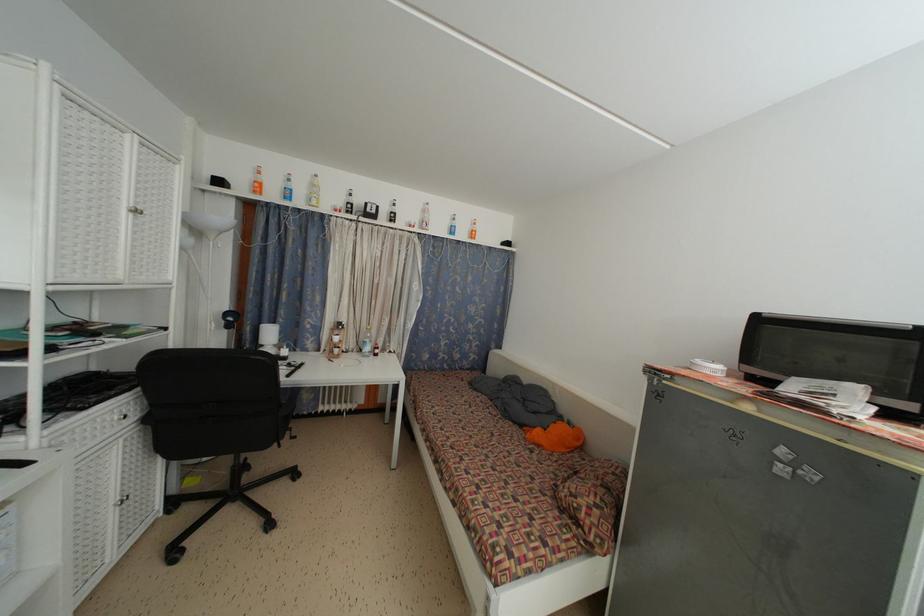
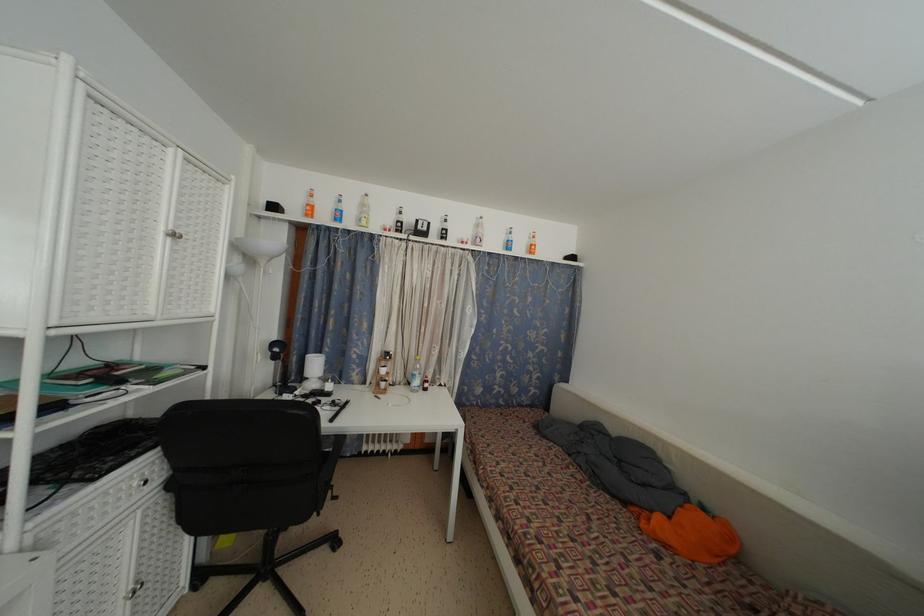
The point at (371, 354) is marked in the first image. Where is the corresponding point in the second image?

(420, 387)